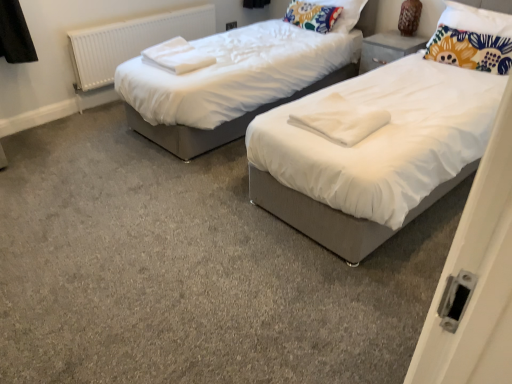
Question: Looking at their shapes, would you say floral fabric pillow at upper right, the second pillow from the left, is wider or thinner than white plastic radiator at left?

Choices:
 (A) thin
 (B) wide

Answer: (B)

Question: Is floral fabric pillow at upper right, positioned as the first pillow in front-to-back order, taller or shorter than white plastic radiator at left?

Choices:
 (A) tall
 (B) short

Answer: (B)

Question: Considering the real-world distances, which object is closest to the white soft towel at center, the 1th linen viewed from the front?

Choices:
 (A) matte gray nightstand at upper right
 (B) white soft towels at upper left, the 2th linen in the bottom-to-top sequence
 (C) floral fabric pillow at upper center, placed as the 2th pillow when sorted from right to left
 (D) white plastic radiator at left
 (E) floral fabric pillow at upper right, placed as the 1th pillow when sorted from right to left

Answer: (B)

Question: Which of these objects is positioned closest to the white soft towel at center, which is counted as the 2th linen, starting from the left?

Choices:
 (A) white soft towels at upper left, the 1th linen in the back-to-front sequence
 (B) matte gray nightstand at upper right
 (C) white plastic radiator at left
 (D) floral fabric pillow at upper right, the 2th pillow when ordered from back to front
 (E) floral fabric pillow at upper center, which ranks as the second pillow in front-to-back order

Answer: (A)